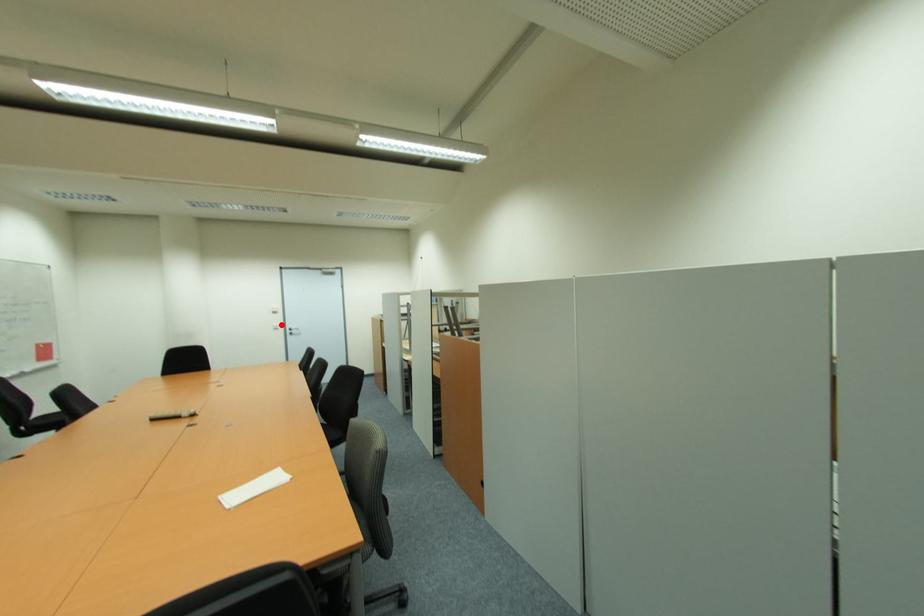
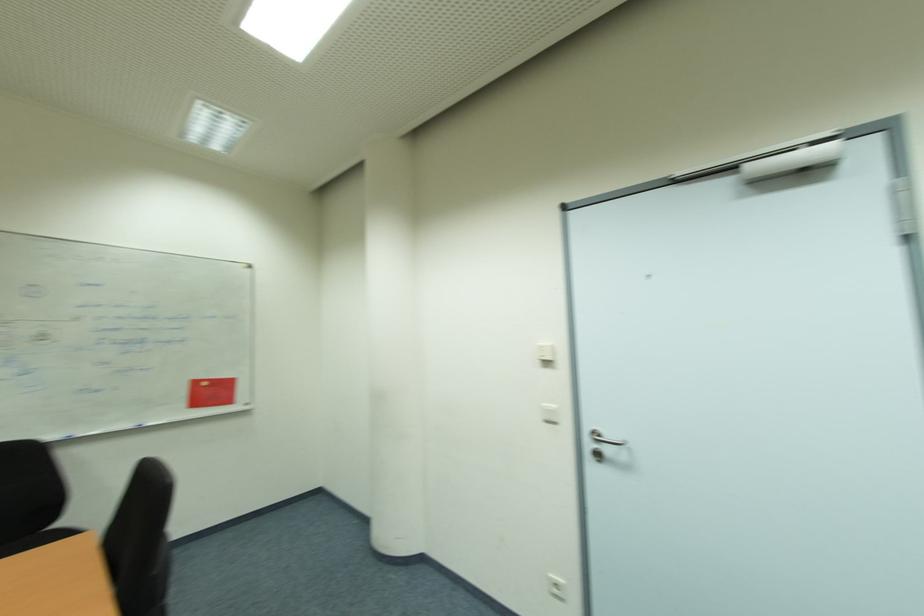
Question: I am providing you with two images of the same scene from different viewpoints. In image1, a red point is highlighted. Considering the same 3D point in image2, which of the following is correct?

Choices:
 (A) It is closer
 (B) It is farther

Answer: (B)